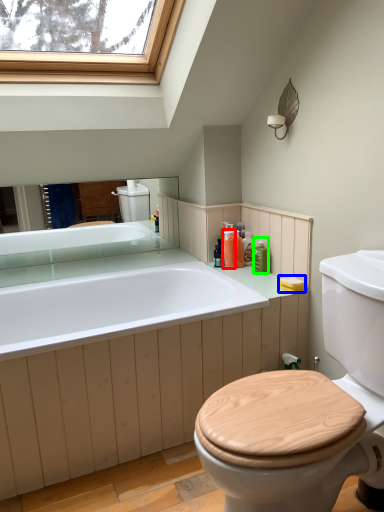
Question: Which object is the farthest from toiletry (highlighted by a red box)? Choose among these: soap (highlighted by a blue box) or toiletry (highlighted by a green box).

Choices:
 (A) soap
 (B) toiletry

Answer: (A)